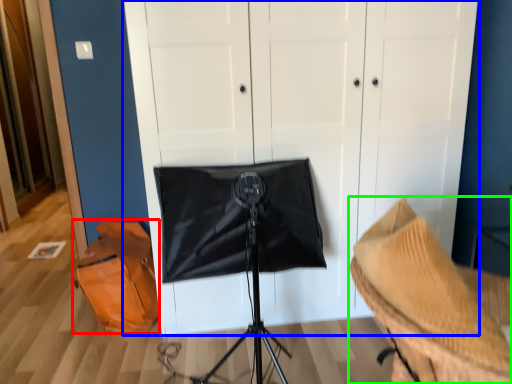
Question: Which object is the closest to the messenger bag (highlighted by a red box)? Choose among these: dresser (highlighted by a blue box) or furniture (highlighted by a green box).

Choices:
 (A) dresser
 (B) furniture

Answer: (A)